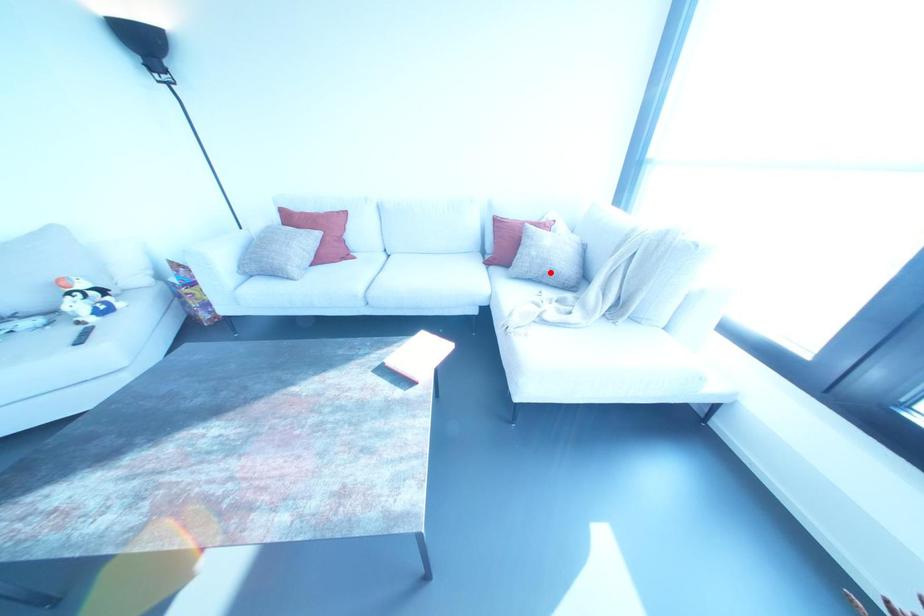
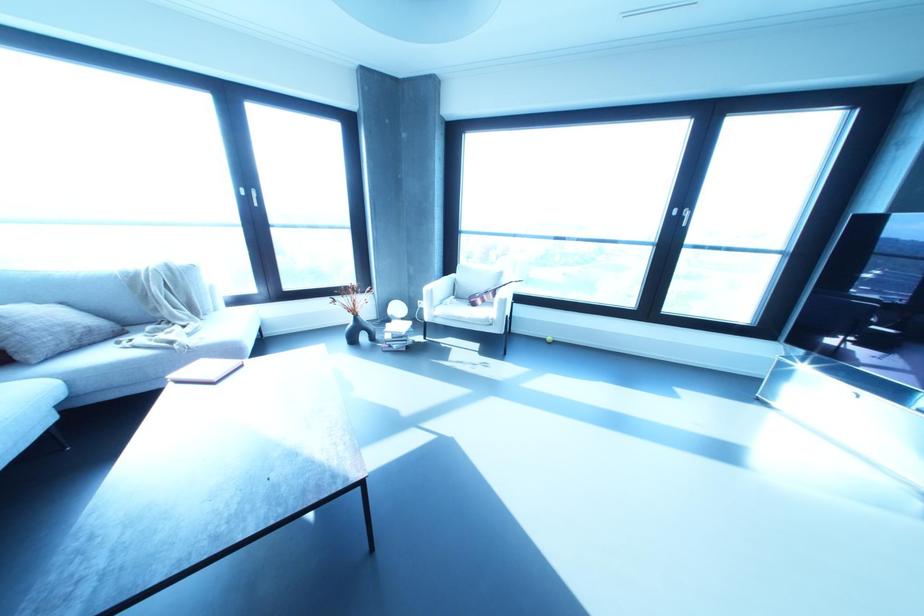
In the second image, find the point that corresponds to the highlighted location in the first image.

(90, 330)